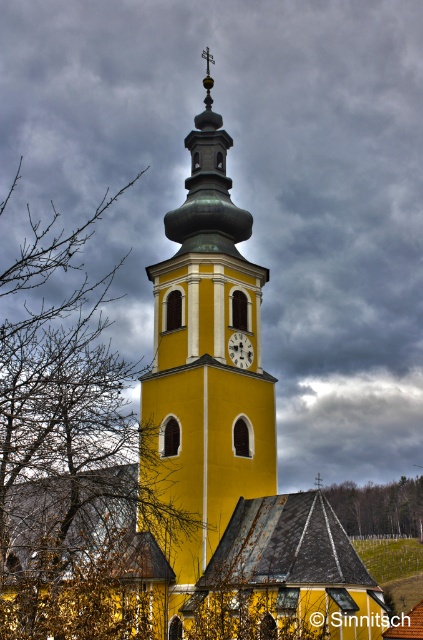
Question: Considering the real-world distances, which object is closest to the yellow matte clock tower at center?

Choices:
 (A) green leafy tree at center
 (B) matte yellow clock at center

Answer: (B)

Question: Does green leafy tree at center have a greater width compared to matte yellow clock at center?

Choices:
 (A) yes
 (B) no

Answer: (A)

Question: Is yellow matte clock tower at center wider than green leafy tree at center?

Choices:
 (A) no
 (B) yes

Answer: (A)

Question: Which of the following is the closest to the observer?

Choices:
 (A) (246, 358)
 (B) (93, 625)
 (C) (222, 445)

Answer: (B)

Question: Does bare branches at left have a smaller size compared to yellow matte clock tower at center?

Choices:
 (A) no
 (B) yes

Answer: (A)

Question: Which object is the farthest from the bare branches at left?

Choices:
 (A) matte yellow clock at center
 (B) green leafy tree at center

Answer: (B)